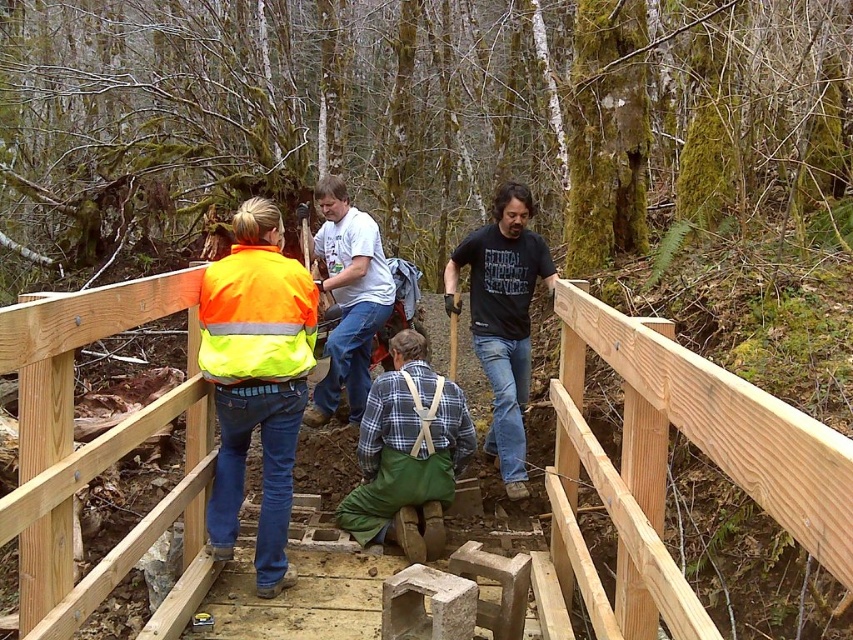
You are a safety inspector assessing the construction site. You notice the natural wood bridge at center and the high visibility fabric safety vest at center. Which object is positioned higher from the ground?

The natural wood bridge at center is much taller than the high visibility fabric safety vest at center, so the natural wood bridge at center is positioned higher from the ground.

You are a hiker who just arrived at the bridge. You notice a point marked at coordinates (503,317) on the bridge. What object is located at that point?

The point at coordinates (503,317) corresponds to the black cotton t shirt at center.